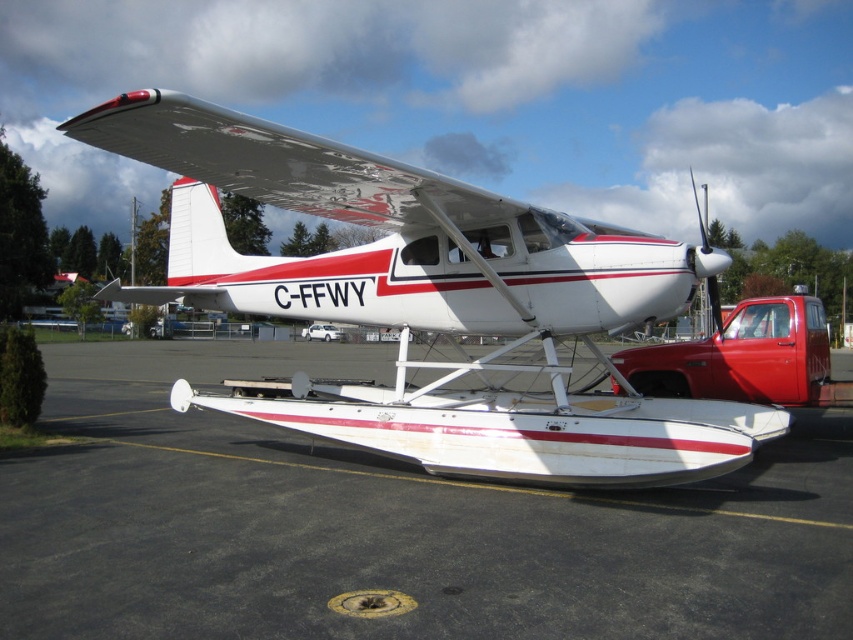
You are a pilot planning to park your new seaplane. You notice the white asphalt tarmac at center and the white matte seaplane at center in the image. Which one takes up more space on the ground?

The white matte seaplane at center takes up more space on the ground than the white asphalt tarmac at center because the white asphalt tarmac at center has a smaller size compared to the white matte seaplane at center.